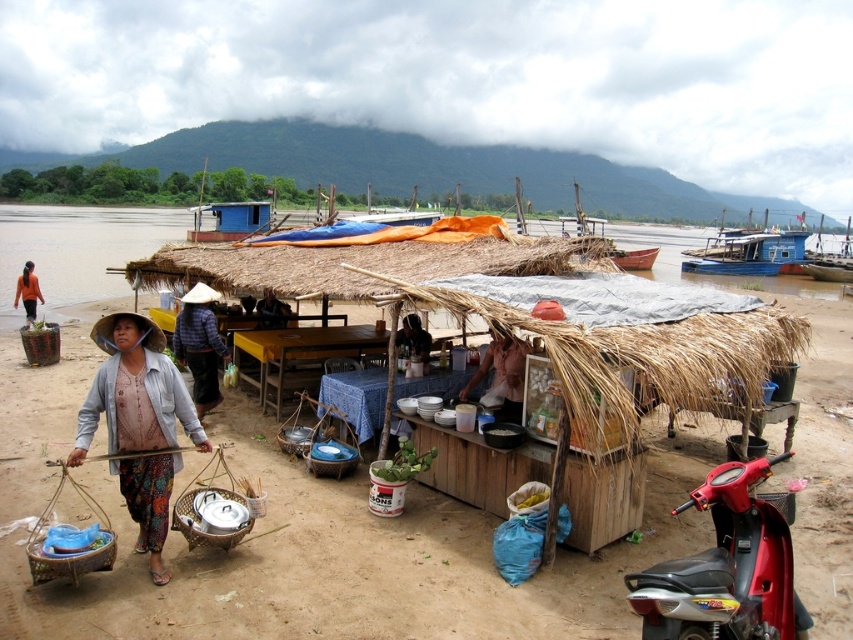
Between printed cotton skirt at lower left and blue wooden boat at center, which one appears on the right side from the viewer's perspective?

Positioned to the right is blue wooden boat at center.

Image resolution: width=853 pixels, height=640 pixels. What do you see at coordinates (134, 392) in the screenshot?
I see `printed cotton skirt at lower left` at bounding box center [134, 392].

Identify the location of printed cotton skirt at lower left. This screenshot has height=640, width=853. (134, 392).

Which is in front, point (837, 573) or point (473, 376)?

Point (837, 573) is in front.

Can you confirm if brown thatch hut at center is wider than light pink fabric at center?

Indeed, brown thatch hut at center has a greater width compared to light pink fabric at center.

Where is `brown thatch hut at center`? The width and height of the screenshot is (853, 640). brown thatch hut at center is located at coordinates (283, 502).

From the picture: Can you confirm if brown thatch hut at center is wider than dark blue fabric at center?

Yes.

Does brown thatch hut at center have a lesser height compared to dark blue fabric at center?

In fact, brown thatch hut at center may be taller than dark blue fabric at center.

Does point (126, 557) come behind point (289, 308)?

No, (126, 557) is in front of (289, 308).

Locate an element on the screen. Image resolution: width=853 pixels, height=640 pixels. brown thatch hut at center is located at coordinates (283, 502).